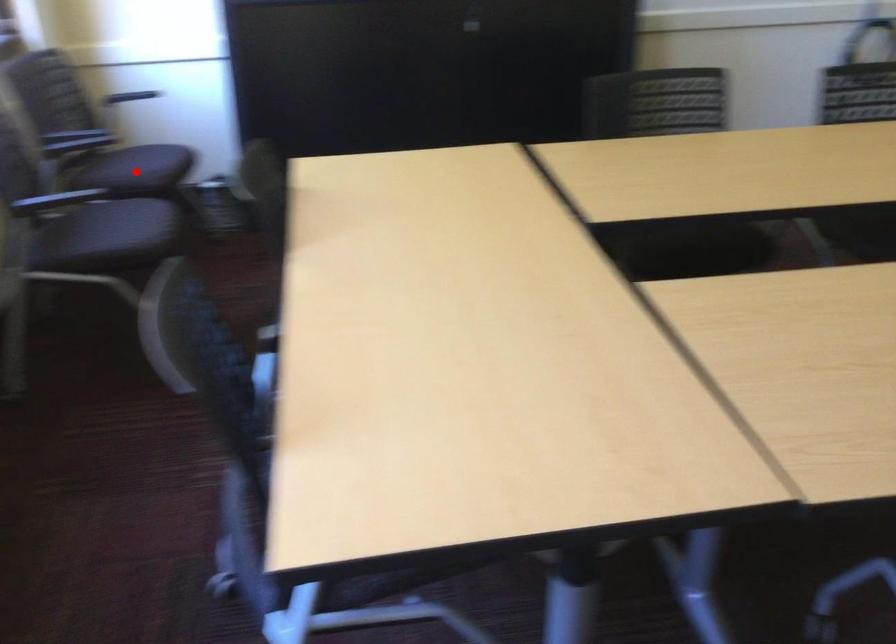
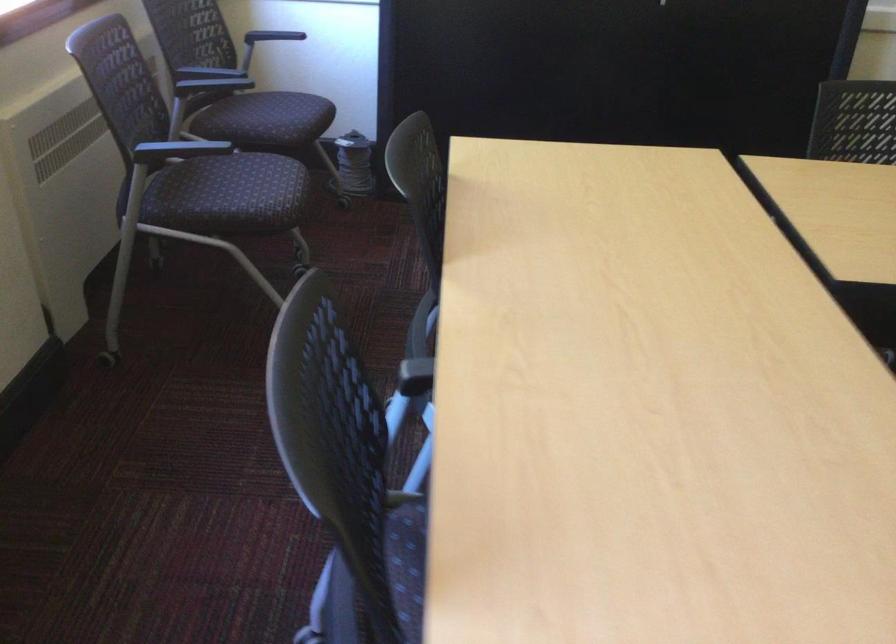
Question: I am providing you with two images of the same scene from different viewpoints. A red point is shown in image1. For the corresponding object point in image2, is it positioned nearer or farther from the camera?

Choices:
 (A) Nearer
 (B) Farther

Answer: (A)